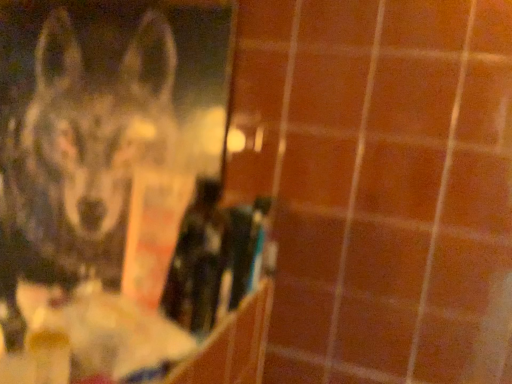
Locate an element on the screen. This screenshot has height=384, width=512. matte glass mirror at upper left is located at coordinates (101, 204).

The height and width of the screenshot is (384, 512). What do you see at coordinates (101, 204) in the screenshot?
I see `matte glass mirror at upper left` at bounding box center [101, 204].

Identify the location of matte glass mirror at upper left. (101, 204).